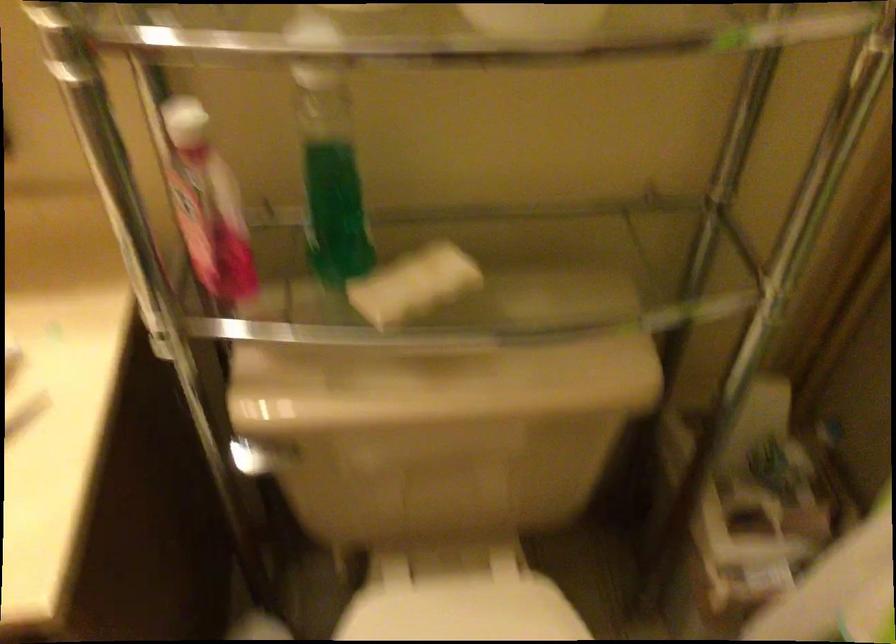
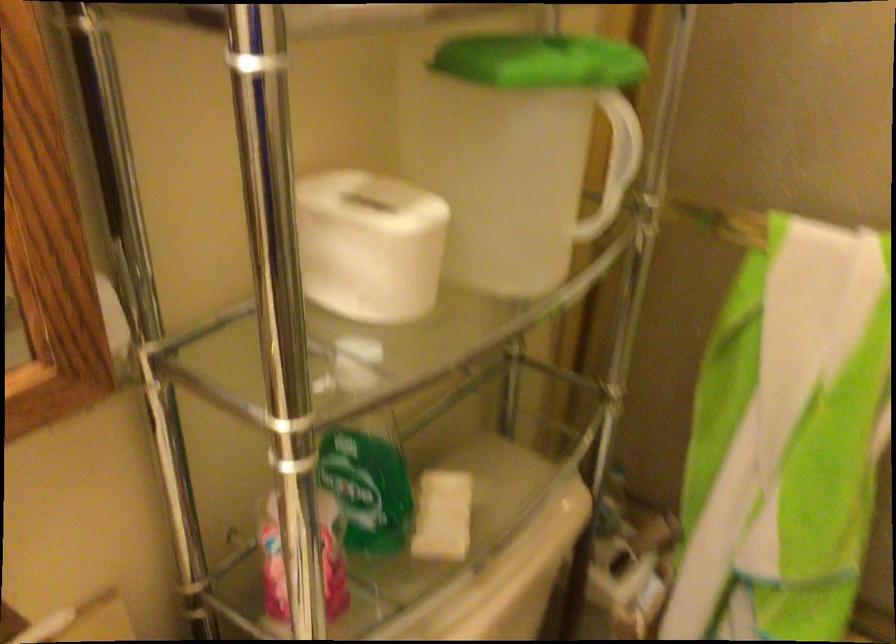
Question: The first image is from the beginning of the video and the second image is from the end. How did the camera likely rotate when shooting the video?

Choices:
 (A) Left
 (B) Right
 (C) Up
 (D) Down

Answer: (B)